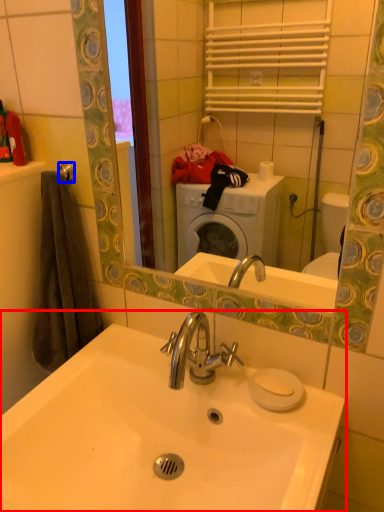
Question: Which point is closer to the camera, sink (highlighted by a red box) or towel bar (highlighted by a blue box)?

Choices:
 (A) sink
 (B) towel bar

Answer: (A)